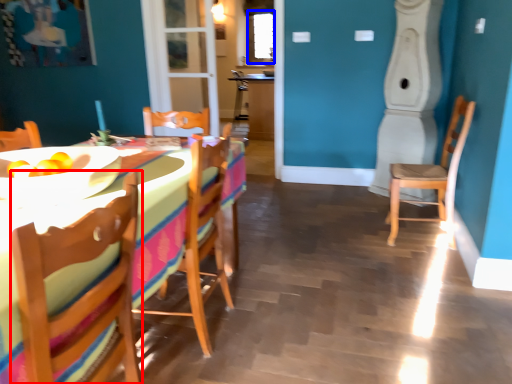
Question: Which point is further to the camera, chair (highlighted by a red box) or window screen (highlighted by a blue box)?

Choices:
 (A) chair
 (B) window screen

Answer: (B)